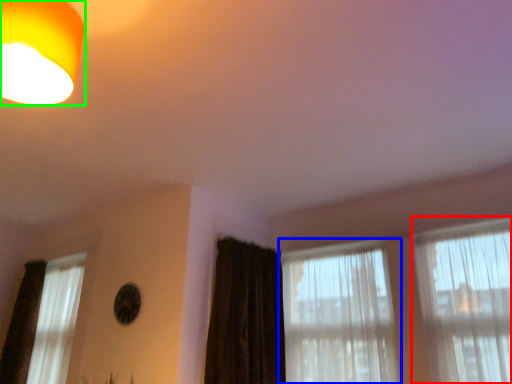
Question: Considering the real-world distances, which object is closest to window (highlighted by a red box)? window (highlighted by a blue box) or lamp (highlighted by a green box).

Choices:
 (A) window
 (B) lamp

Answer: (A)